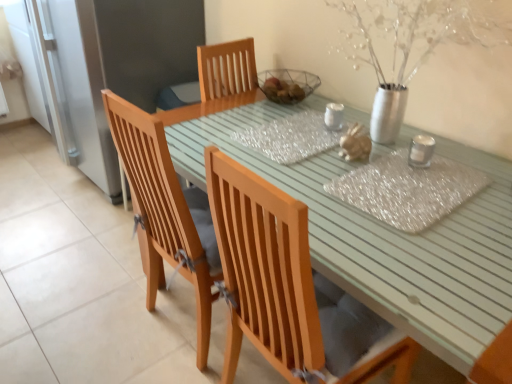
The image size is (512, 384). Identify the location of clear plastic placemat at center. pos(408,189).

What do you see at coordinates (387, 237) in the screenshot? I see `light green wooden table at center` at bounding box center [387, 237].

Measure the distance between wooden chair at center, positioned as the 2th chair in top-to-bottom order, and camera.

wooden chair at center, positioned as the 2th chair in top-to-bottom order, and camera are 29.92 inches apart from each other.

The height and width of the screenshot is (384, 512). What do you see at coordinates (355, 144) in the screenshot? I see `translucent glass jar at center` at bounding box center [355, 144].

The image size is (512, 384). Identify the location of clear plastic placemat at center. (408, 189).

Which object is positioned more to the left, clear plastic placemat at center or wooden chair at center, the second chair in the bottom-to-top sequence?

Positioned to the left is wooden chair at center, the second chair in the bottom-to-top sequence.

Would you say clear plastic placemat at center is a long distance from wooden chair at center, which is the 1th chair in top-to-bottom order?

clear plastic placemat at center is near wooden chair at center, which is the 1th chair in top-to-bottom order, not far away.

From the picture: Do you think clear plastic placemat at center is within wooden chair at center, which is the 1th chair in top-to-bottom order, or outside of it?

clear plastic placemat at center is not enclosed by wooden chair at center, which is the 1th chair in top-to-bottom order.

Is clear plastic placemat at center turned away from wooden chair at center, the second chair in the bottom-to-top sequence?

No, clear plastic placemat at center is not facing away from wooden chair at center, the second chair in the bottom-to-top sequence.

Relative to light green wooden table at center, is wooden chair at center, positioned as the 2th chair in top-to-bottom order, in front or behind?

In the image, wooden chair at center, positioned as the 2th chair in top-to-bottom order, appears behind light green wooden table at center.

Between wooden chair at center, the first chair ordered from the bottom, and light green wooden table at center, which one appears on the left side from the viewer's perspective?

wooden chair at center, the first chair ordered from the bottom.

From a real-world perspective, is wooden chair at center, the first chair ordered from the bottom, positioned under light green wooden table at center based on gravity?

No.

Are wooden chair at center, positioned as the 2th chair in top-to-bottom order, and light green wooden table at center located far from each other?

No, wooden chair at center, positioned as the 2th chair in top-to-bottom order, is in close proximity to light green wooden table at center.

The height and width of the screenshot is (384, 512). I want to click on food behind the wooden chair at center, the first chair ordered from the bottom, so click(355, 144).

In terms of height, does translucent glass jar at center look taller or shorter compared to wooden chair at center, the first chair ordered from the bottom?

In the image, translucent glass jar at center appears to be taller than wooden chair at center, the first chair ordered from the bottom.

Between wooden chair at center, positioned as the 2th chair in top-to-bottom order, and clear plastic placemat at center, which one has more height?

With more height is wooden chair at center, positioned as the 2th chair in top-to-bottom order.

Is wooden chair at center, positioned as the 2th chair in top-to-bottom order, directly adjacent to clear plastic placemat at center?

wooden chair at center, positioned as the 2th chair in top-to-bottom order, and clear plastic placemat at center are clearly separated.

Which object is positioned more to the left, wooden chair at center, the first chair ordered from the bottom, or clear plastic placemat at center?

wooden chair at center, the first chair ordered from the bottom.

Which of these two, wooden chair at center, the first chair ordered from the bottom, or clear plastic placemat at center, is thinner?

wooden chair at center, the first chair ordered from the bottom, is thinner.

Is light green wooden table at center at the left side of wooden chair at center, which is the 1th chair in top-to-bottom order?

No, light green wooden table at center is not to the left of wooden chair at center, which is the 1th chair in top-to-bottom order.

Which object is closer to the camera, light green wooden table at center or wooden chair at center, the second chair in the bottom-to-top sequence?

Positioned in front is light green wooden table at center.

Based on the photo, is light green wooden table at center taller than wooden chair at center, which is the 1th chair in top-to-bottom order?

No.

Is light green wooden table at center situated inside wooden chair at center, the second chair in the bottom-to-top sequence, or outside?

light green wooden table at center lies outside wooden chair at center, the second chair in the bottom-to-top sequence.

Can you confirm if clear plastic placemat at center is bigger than light green wooden table at center?

Incorrect, clear plastic placemat at center is not larger than light green wooden table at center.

The width and height of the screenshot is (512, 384). What are the coordinates of `place mat above the light green wooden table at center (from a real-world perspective)` in the screenshot? It's located at (408, 189).

In the image, is clear plastic placemat at center positioned in front of or behind light green wooden table at center?

clear plastic placemat at center is positioned farther from the viewer than light green wooden table at center.

From the image's perspective, which object appears higher, clear plastic placemat at center or light green wooden table at center?

clear plastic placemat at center.

Is light green wooden table at center not inside clear plastic placemat at center?

Indeed, light green wooden table at center is completely outside clear plastic placemat at center.

Can you tell me how much light green wooden table at center and clear plastic placemat at center differ in facing direction?

light green wooden table at center and clear plastic placemat at center are facing 0.211 degrees away from each other.

Is light green wooden table at center looking in the opposite direction of clear plastic placemat at center?

No.

Is light green wooden table at center far from clear plastic placemat at center?

No, light green wooden table at center is not far from clear plastic placemat at center.

Locate an element on the screen. The width and height of the screenshot is (512, 384). the 2nd chair to the left of the clear plastic placemat at center, counting from the anchor's position is located at coordinates (161, 211).

Locate an element on the screen. Image resolution: width=512 pixels, height=384 pixels. the 2nd chair above the light green wooden table at center (from a real-world perspective) is located at coordinates (290, 288).

From the image, which object appears to be farther from wooden chair at center, which is the 1th chair in top-to-bottom order, clear plastic placemat at center or light green wooden table at center?

clear plastic placemat at center.

Estimate the real-world distances between objects in this image. Which object is closer to translucent glass jar at center, light green wooden table at center or clear plastic placemat at center?

clear plastic placemat at center is closer to translucent glass jar at center.

Looking at the image, which one is located closer to wooden chair at center, the first chair ordered from the bottom, light green wooden table at center or translucent glass jar at center?

light green wooden table at center.

Looking at the image, which one is located closer to wooden chair at center, the first chair ordered from the bottom, wooden chair at center, the second chair in the bottom-to-top sequence, or clear plastic placemat at center?

Among the two, wooden chair at center, the second chair in the bottom-to-top sequence, is located nearer to wooden chair at center, the first chair ordered from the bottom.

Looking at the image, which one is located closer to clear plastic placemat at center, translucent glass jar at center or wooden chair at center, the first chair ordered from the bottom?

Among the two, translucent glass jar at center is located nearer to clear plastic placemat at center.

Looking at the image, which one is located further to translucent glass jar at center, wooden chair at center, the second chair in the bottom-to-top sequence, or light green wooden table at center?

wooden chair at center, the second chair in the bottom-to-top sequence.

Looking at the image, which one is located closer to translucent glass jar at center, wooden chair at center, which is the 1th chair in top-to-bottom order, or wooden chair at center, positioned as the 2th chair in top-to-bottom order?

wooden chair at center, positioned as the 2th chair in top-to-bottom order.

When comparing their distances from wooden chair at center, the second chair in the bottom-to-top sequence, does translucent glass jar at center or wooden chair at center, the first chair ordered from the bottom, seem further?

Among the two, translucent glass jar at center is located further to wooden chair at center, the second chair in the bottom-to-top sequence.

Where is `chair between wooden chair at center, the second chair in the bottom-to-top sequence, and translucent glass jar at center, in the horizontal direction`? chair between wooden chair at center, the second chair in the bottom-to-top sequence, and translucent glass jar at center, in the horizontal direction is located at coordinates (290, 288).

The height and width of the screenshot is (384, 512). Identify the location of place mat between translucent glass jar at center and wooden chair at center, the first chair ordered from the bottom, in the up-down direction. (408, 189).

Where is `food between wooden chair at center, the second chair in the bottom-to-top sequence, and clear plastic placemat at center from left to right`? The image size is (512, 384). food between wooden chair at center, the second chair in the bottom-to-top sequence, and clear plastic placemat at center from left to right is located at coordinates (355, 144).

Identify the location of chair located between wooden chair at center, the second chair in the bottom-to-top sequence, and clear plastic placemat at center in the left-right direction. The width and height of the screenshot is (512, 384). (290, 288).